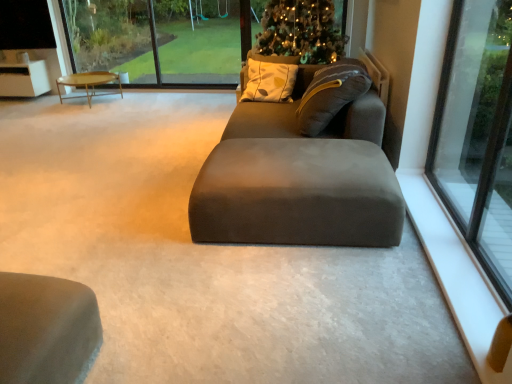
Question: Considering the relative positions of white smooth window sill at lower right and transparent glass window at right in the image provided, is white smooth window sill at lower right behind transparent glass window at right?

Choices:
 (A) yes
 (B) no

Answer: (A)

Question: From the image's perspective, would you say white smooth window sill at lower right is positioned over transparent glass window at right?

Choices:
 (A) yes
 (B) no

Answer: (B)

Question: Does white smooth window sill at lower right contain transparent glass window at right?

Choices:
 (A) yes
 (B) no

Answer: (B)

Question: Considering the relative positions of white smooth window sill at lower right and transparent glass window at right in the image provided, is white smooth window sill at lower right to the right of transparent glass window at right from the viewer's perspective?

Choices:
 (A) no
 (B) yes

Answer: (A)

Question: Is white smooth window sill at lower right positioned beyond the bounds of transparent glass window at right?

Choices:
 (A) yes
 (B) no

Answer: (A)

Question: Considering the relative sizes of white smooth window sill at lower right and transparent glass window at right in the image provided, is white smooth window sill at lower right taller than transparent glass window at right?

Choices:
 (A) yes
 (B) no

Answer: (B)

Question: Is wooden polished coffee table at left taller than green plastic swing set at upper center?

Choices:
 (A) no
 (B) yes

Answer: (A)

Question: From a real-world perspective, is wooden polished coffee table at left positioned under green plastic swing set at upper center based on gravity?

Choices:
 (A) no
 (B) yes

Answer: (B)

Question: Considering the relative sizes of wooden polished coffee table at left and green plastic swing set at upper center in the image provided, is wooden polished coffee table at left thinner than green plastic swing set at upper center?

Choices:
 (A) no
 (B) yes

Answer: (A)

Question: From the image's perspective, is wooden polished coffee table at left on top of green plastic swing set at upper center?

Choices:
 (A) yes
 (B) no

Answer: (B)

Question: Is wooden polished coffee table at left positioned beyond the bounds of green plastic swing set at upper center?

Choices:
 (A) no
 (B) yes

Answer: (B)

Question: Considering the relative sizes of wooden polished coffee table at left and green plastic swing set at upper center in the image provided, is wooden polished coffee table at left smaller than green plastic swing set at upper center?

Choices:
 (A) yes
 (B) no

Answer: (B)

Question: Is wooden polished coffee table at left located within white smooth window sill at lower right?

Choices:
 (A) yes
 (B) no

Answer: (B)